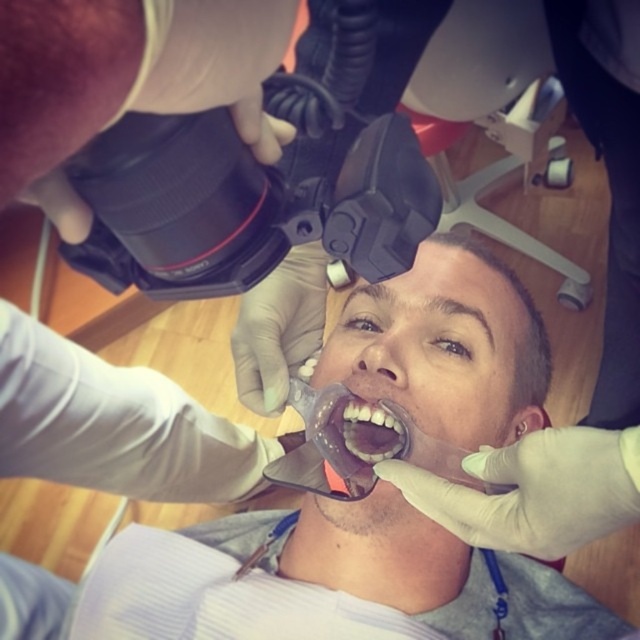
Can you confirm if clear plastic mouthguard at center is taller than translucent plastic mouthpiece at center?

Yes.

Can you confirm if clear plastic mouthguard at center is bigger than translucent plastic mouthpiece at center?

Indeed, clear plastic mouthguard at center has a larger size compared to translucent plastic mouthpiece at center.

Image resolution: width=640 pixels, height=640 pixels. Identify the location of clear plastic mouthguard at center. (291, 579).